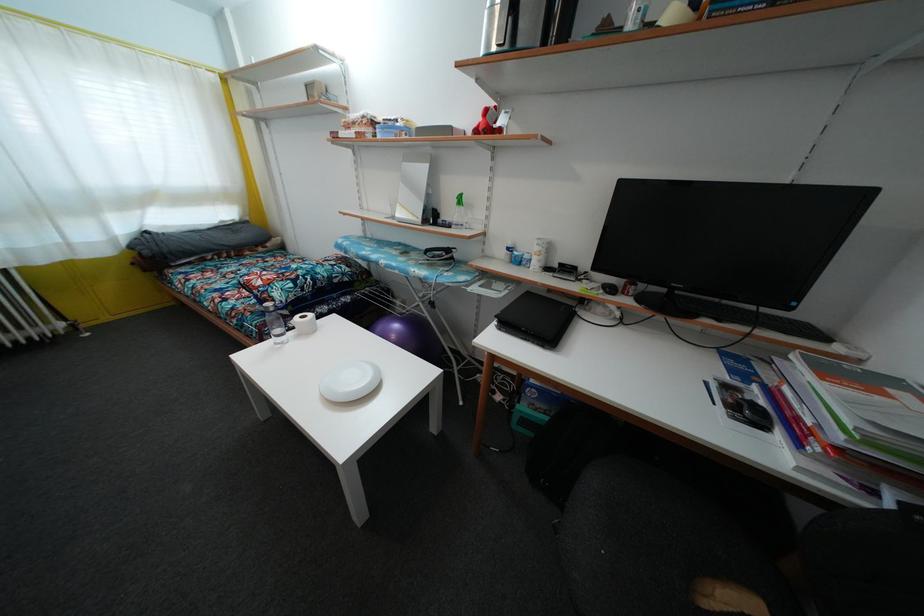
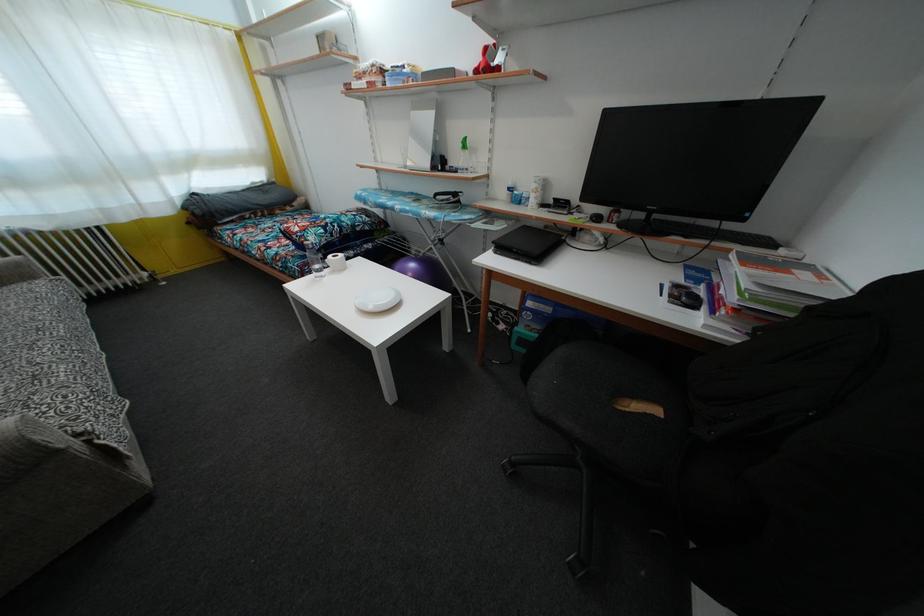
In the second image, find the point that corresponds to pixel 266 299 in the first image.

(305, 244)